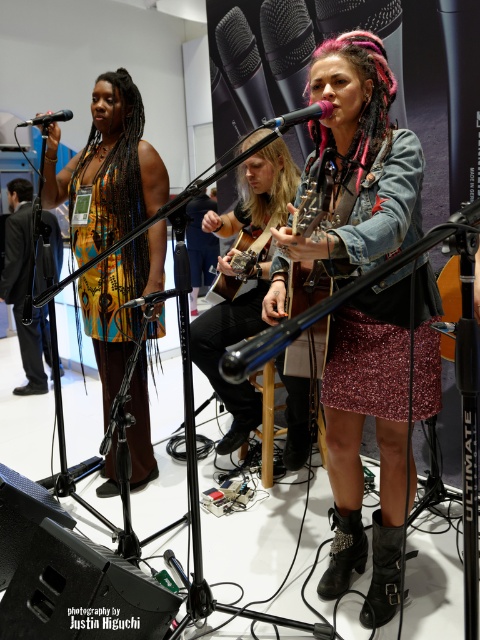
Who is taller, sparkly pink skirt at center or matte black microphone at upper left?

Result: Standing taller between the two is sparkly pink skirt at center.

Locate an element on the screen. The width and height of the screenshot is (480, 640). sparkly pink skirt at center is located at coordinates (360, 435).

Which of these two, denim jacket at center or black matte microphone at center, stands shorter?

black matte microphone at center

Who is lower down, denim jacket at center or black matte microphone at center?

denim jacket at center is below.

In the scene shown: Who is more forward, [217,342] or [261,122]?

Positioned in front is point [217,342].

Locate an element on the screen. The image size is (480, 640). denim jacket at center is located at coordinates (247, 276).

Does sparkly pink skirt at center have a smaller size compared to denim jacket at center?

No, sparkly pink skirt at center is not smaller than denim jacket at center.

Can you confirm if sparkly pink skirt at center is wider than denim jacket at center?

Yes.

Is point (356, 106) farther from camera compared to point (204, 348)?

That is False.

Image resolution: width=480 pixels, height=640 pixels. Find the location of `sparkly pink skirt at center`. sparkly pink skirt at center is located at coordinates (360, 435).